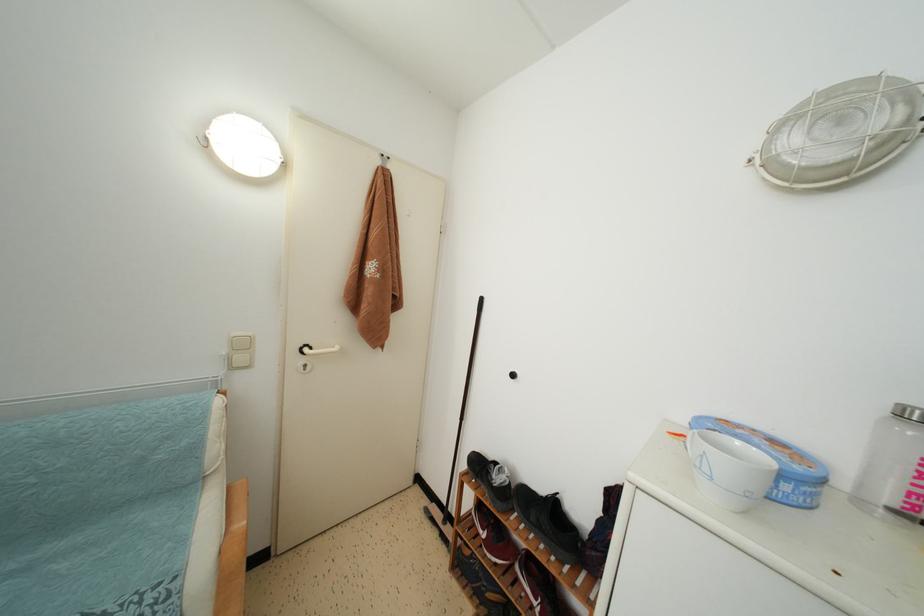
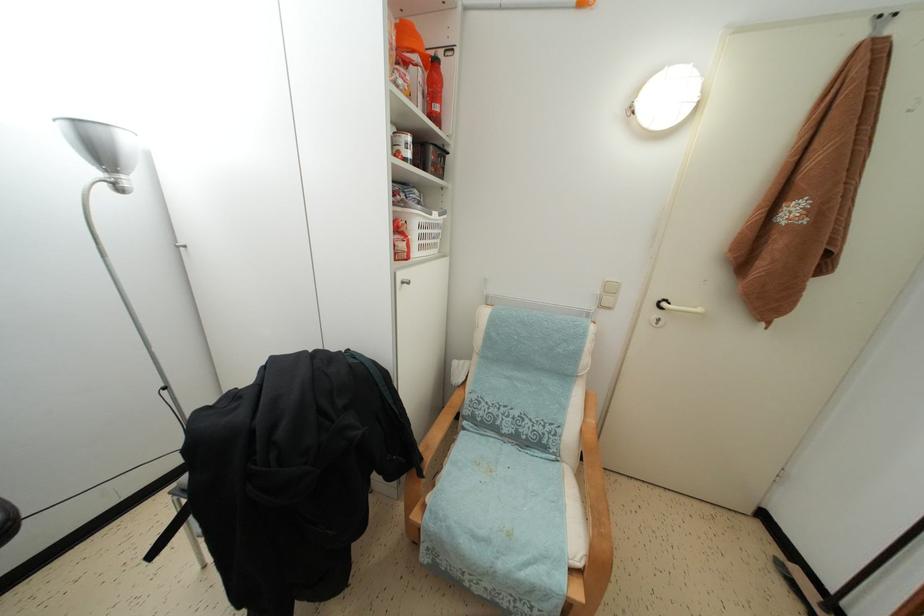
Question: The camera is either moving clockwise (left) or counter-clockwise (right) around the object. The first image is from the beginning of the video and the second image is from the end. Is the camera moving left or right when shooting the video?

Choices:
 (A) Left
 (B) Right

Answer: (B)